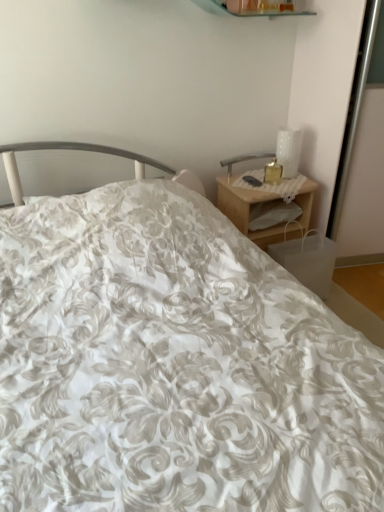
Locate an element on the screen. The height and width of the screenshot is (512, 384). empty space that is ontop of woodennightstand at right (from a real-world perspective) is located at coordinates (266, 180).